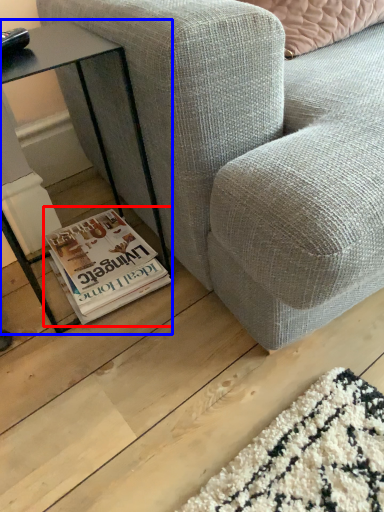
Question: Which of the following is the farthest to the observer, paperback book (highlighted by a red box) or table (highlighted by a blue box)?

Choices:
 (A) paperback book
 (B) table

Answer: (A)